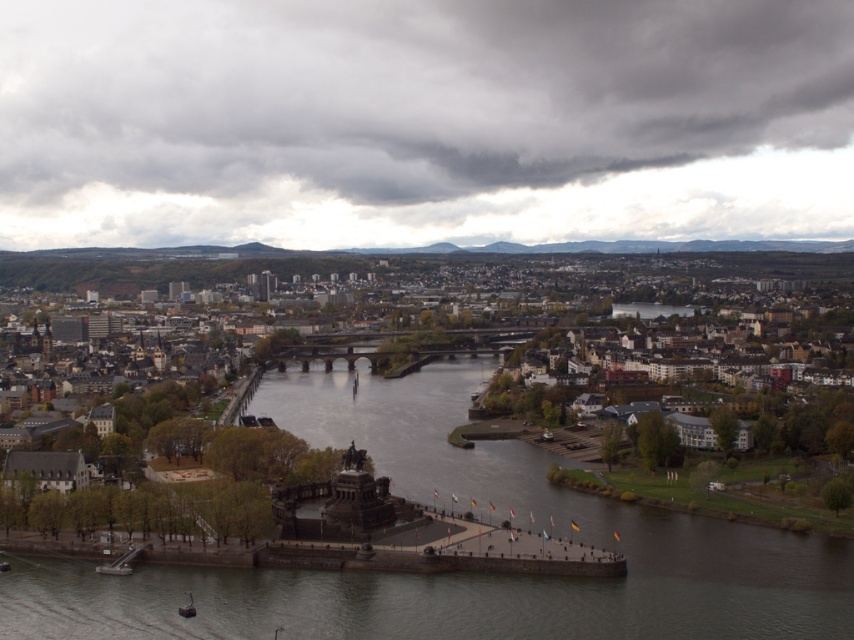
Question: Is dark gray cloud at upper center positioned at the back of brown stone buildings at center?

Choices:
 (A) no
 (B) yes

Answer: (B)

Question: Is brown stone buildings at center wider than metallic gray boat at lower center?

Choices:
 (A) yes
 (B) no

Answer: (A)

Question: Which object is farther from the camera taking this photo?

Choices:
 (A) brown stone buildings at center
 (B) dark gray cloud at upper center

Answer: (B)

Question: Does dark gray cloud at upper center appear over brown stone buildings at center?

Choices:
 (A) no
 (B) yes

Answer: (B)

Question: Which of the following is the farthest from the observer?

Choices:
 (A) (355, 28)
 (B) (671, 253)

Answer: (A)

Question: Which object is the closest to the brown stone buildings at center?

Choices:
 (A) metallic gray boat at lower center
 (B) dark gray cloud at upper center

Answer: (B)